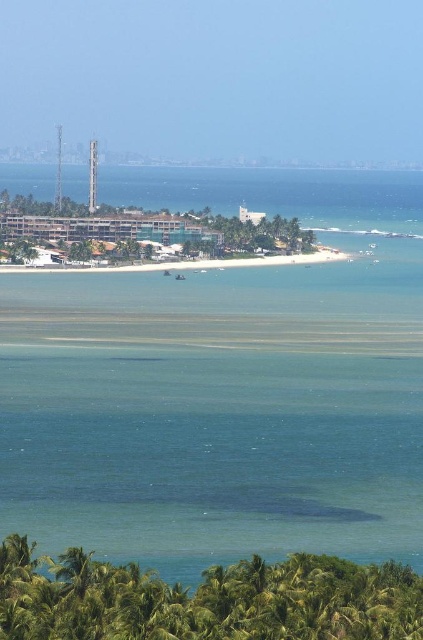
Question: Does green leafy palm tree at lower left have a smaller size compared to white sand beach at center?

Choices:
 (A) no
 (B) yes

Answer: (A)

Question: Can you confirm if clear blue water at center is smaller than green leafy palm tree at lower left?

Choices:
 (A) no
 (B) yes

Answer: (A)

Question: Which object appears closest to the camera in this image?

Choices:
 (A) green leafy palm tree at lower left
 (B) white sand beach at center

Answer: (A)

Question: Is green leafy palm tree at lower left to the right of white sand beach at center from the viewer's perspective?

Choices:
 (A) no
 (B) yes

Answer: (B)

Question: Based on their relative distances, which object is nearer to the white sand beach at center?

Choices:
 (A) green leafy palm tree at lower left
 (B) clear blue water at center

Answer: (B)

Question: Which object is positioned closest to the clear blue water at center?

Choices:
 (A) white sand beach at center
 (B) green leafy palm tree at lower left

Answer: (A)